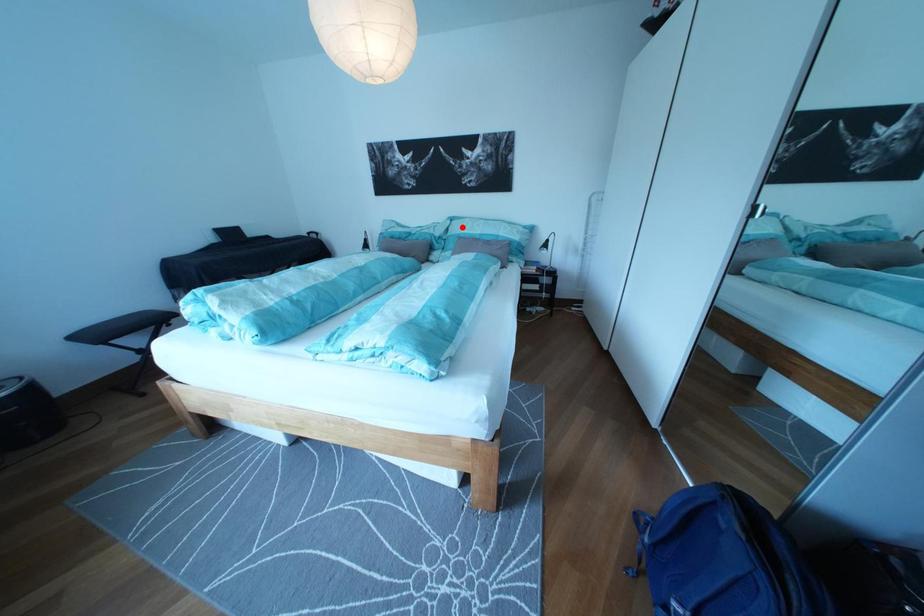
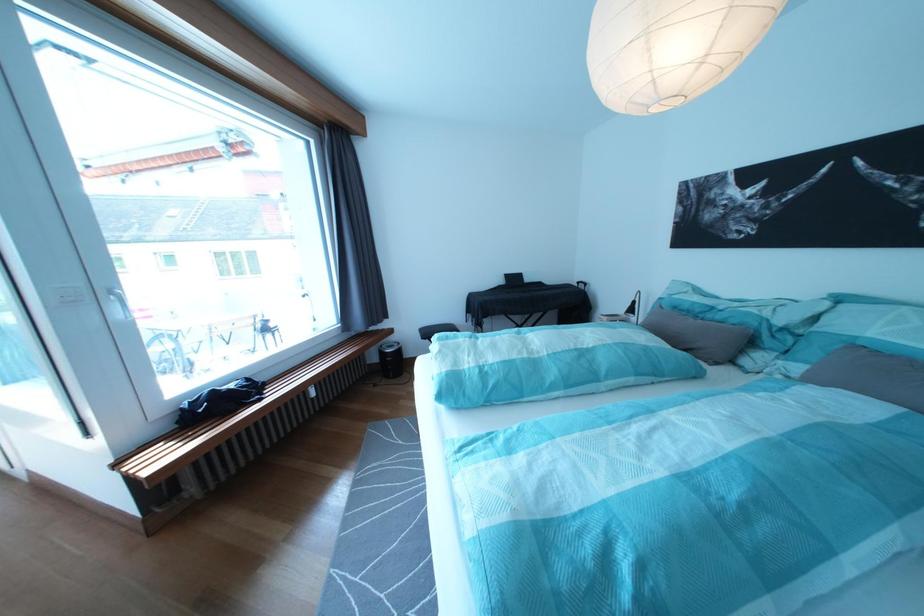
Question: I am providing you with two images of the same scene from different viewpoints. Given a red point in image1, look at the same physical point in image2. Is it:

Choices:
 (A) Closer to the viewpoint
 (B) Farther from the viewpoint

Answer: (B)